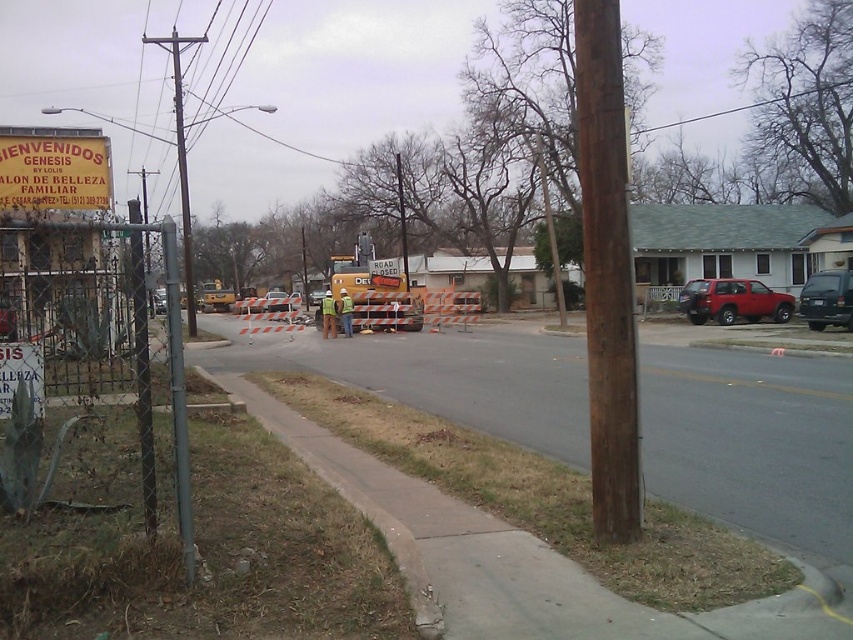
You are a city planner assessing the street scene. The brown wooden telegraph pole at left and the black wire at upper center are both present. Which object has a smaller width?

The brown wooden telegraph pole at left has a smaller width compared to the black wire at upper center.

You are driving a car and need to park near the construction site. The black matte suv at right is parked at coordinates 0.469, 0.971. Can you park your car in the same spot?

The black matte suv at right is already parked at point (827,300), so you cannot park your car in the same spot.